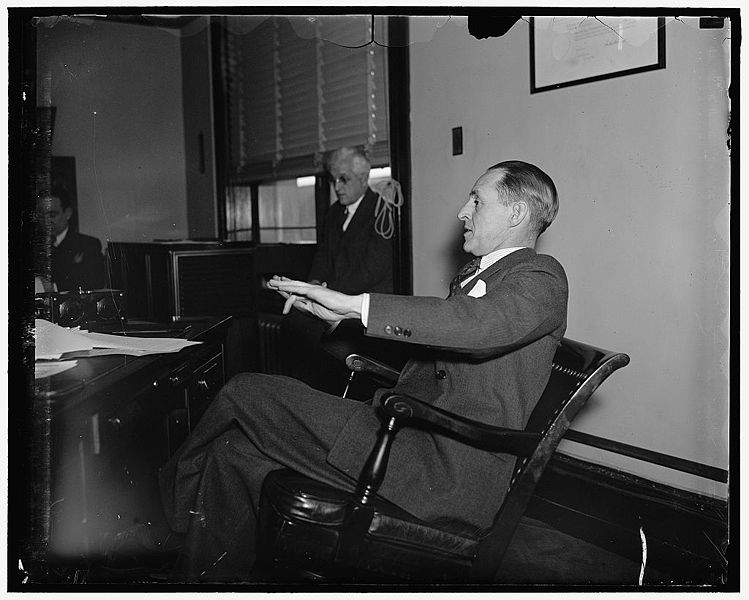
Locate an element on the screen. The width and height of the screenshot is (749, 600). desk is located at coordinates (94, 363).